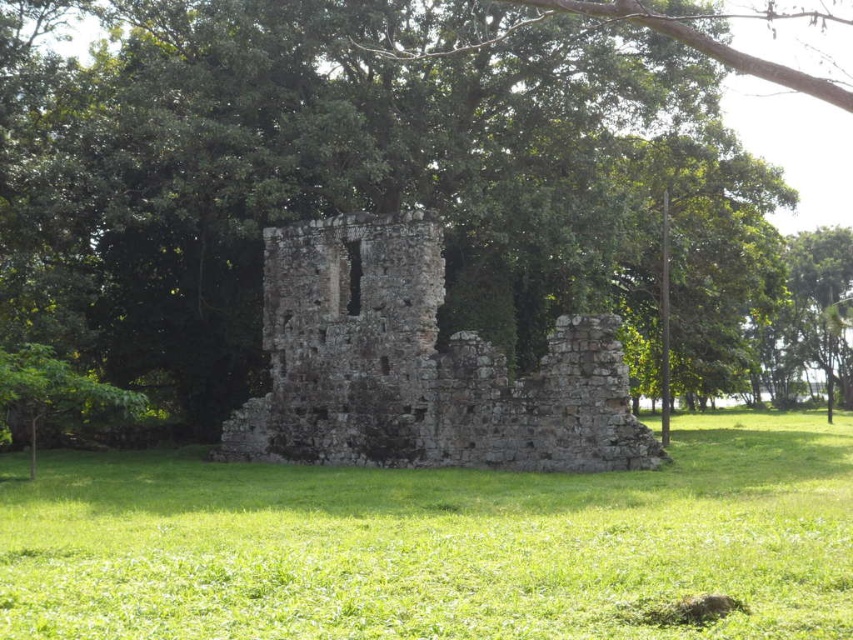
From the picture: You are a gardener planning to mow the lawn around the rustic stone castle at center. Given that your lawnmower can only handle areas smaller than the castle, will the green grass at center be manageable for your equipment?

The green grass at center has a smaller size compared to rustic stone castle at center, so yes, the green grass at center is manageable for the lawnmower since it is smaller than the castle.